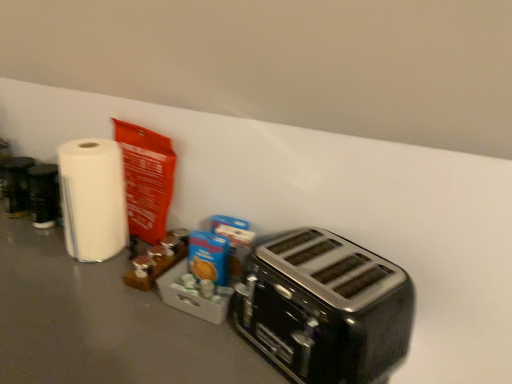
This screenshot has width=512, height=384. What do you see at coordinates (93, 199) in the screenshot?
I see `white glossy paper towel at left` at bounding box center [93, 199].

Find the location of a particular element. The width and height of the screenshot is (512, 384). white glossy paper towel at left is located at coordinates (93, 199).

What do you see at coordinates (324, 308) in the screenshot? I see `black metallic toaster at lower right` at bounding box center [324, 308].

At what (x,y) coordinates should I click in order to perform the action: click on black metallic toaster at lower right. Please return your answer as a coordinate pair (x, y). This screenshot has height=384, width=512. Looking at the image, I should click on (324, 308).

Measure the distance between point (298,256) and camera.

A distance of 36.22 inches exists between point (298,256) and camera.

Find the location of a particular element. This screenshot has height=384, width=512. white glossy paper towel at left is located at coordinates (93, 199).

Is black metallic toaster at lower right to the left or to the right of white glossy paper towel at left in the image?

From the image, it's evident that black metallic toaster at lower right is to the right of white glossy paper towel at left.

Which object is further away from the camera taking this photo, black metallic toaster at lower right or white glossy paper towel at left?

white glossy paper towel at left is further from the camera.

Considering the points (297, 313) and (69, 231), which point is behind, point (297, 313) or point (69, 231)?

The point (69, 231) is farther.

From the image's perspective, which one is positioned higher, black metallic toaster at lower right or white glossy paper towel at left?

From the image's view, white glossy paper towel at left is above.

From a real-world perspective, is black metallic toaster at lower right beneath white glossy paper towel at left?

Yes, from a real-world perspective, black metallic toaster at lower right is beneath white glossy paper towel at left.

Which of these two, black metallic toaster at lower right or white glossy paper towel at left, is thinner?

With smaller width is white glossy paper towel at left.

Who is shorter, black metallic toaster at lower right or white glossy paper towel at left?

black metallic toaster at lower right.

Is black metallic toaster at lower right smaller than white glossy paper towel at left?

No, black metallic toaster at lower right is not smaller than white glossy paper towel at left.

Choose the correct answer: Is black metallic toaster at lower right inside white glossy paper towel at left or outside it?

black metallic toaster at lower right is spatially situated outside white glossy paper towel at left.

Would you say black metallic toaster at lower right is a long distance from white glossy paper towel at left?

No, black metallic toaster at lower right is in close proximity to white glossy paper towel at left.

Is black metallic toaster at lower right looking in the opposite direction of white glossy paper towel at left?

No, black metallic toaster at lower right is not facing away from white glossy paper towel at left.

Find the location of a particular element. The image size is (512, 384). paper towel that appears behind the black metallic toaster at lower right is located at coordinates (93, 199).

Can you confirm if white glossy paper towel at left is positioned to the right of black metallic toaster at lower right?

No.

Relative to black metallic toaster at lower right, is white glossy paper towel at left in front or behind?

In the image, white glossy paper towel at left appears behind black metallic toaster at lower right.

Which is behind, point (95, 260) or point (382, 332)?

The point (95, 260) is farther.

From the image's perspective, which is below, white glossy paper towel at left or black metallic toaster at lower right?

black metallic toaster at lower right.

From a real-world perspective, which object stands above the other?

From a 3D spatial view, white glossy paper towel at left is above.

Does white glossy paper towel at left have a lesser width compared to black metallic toaster at lower right?

Correct, the width of white glossy paper towel at left is less than that of black metallic toaster at lower right.

Looking at this image, between white glossy paper towel at left and black metallic toaster at lower right, which one has less height?

With less height is black metallic toaster at lower right.

Considering the sizes of white glossy paper towel at left and black metallic toaster at lower right in the image, is white glossy paper towel at left bigger or smaller than black metallic toaster at lower right?

Considering their sizes, white glossy paper towel at left takes up less space than black metallic toaster at lower right.

Which is correct: white glossy paper towel at left is inside black metallic toaster at lower right, or outside of it?

white glossy paper towel at left is not enclosed by black metallic toaster at lower right.

Would you consider white glossy paper towel at left to be distant from black metallic toaster at lower right?

No, there isn't a large distance between white glossy paper towel at left and black metallic toaster at lower right.

Is white glossy paper towel at left oriented towards black metallic toaster at lower right?

No, white glossy paper towel at left does not turn towards black metallic toaster at lower right.

In the scene shown: How different are the orientations of white glossy paper towel at left and black metallic toaster at lower right in degrees?

white glossy paper towel at left and black metallic toaster at lower right are facing 20.4 degrees away from each other.

At what (x,y) coordinates should I click in order to perform the action: click on toaster lying in front of the white glossy paper towel at left. Please return your answer as a coordinate pair (x, y). The image size is (512, 384). Looking at the image, I should click on coord(324,308).

Find the location of a particular element. The image size is (512, 384). paper towel above the black metallic toaster at lower right (from a real-world perspective) is located at coordinates (93, 199).

This screenshot has width=512, height=384. What are the coordinates of `toaster below the white glossy paper towel at left (from a real-world perspective)` in the screenshot? It's located at (324, 308).